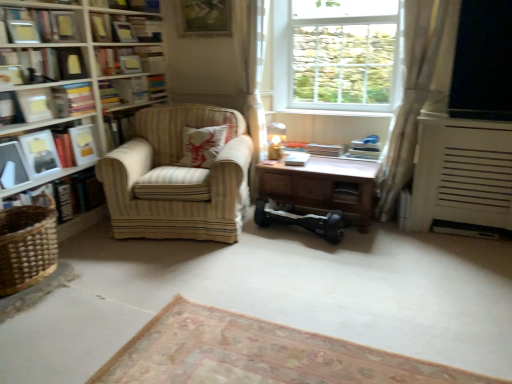
At what (x,y) coordinates should I click in order to perform the action: click on free space between striped fabric armchair at left and carpeted floor at lower center, arranged as the first plain when viewed from the back. Please return your answer as a coordinate pair (x, y). The width and height of the screenshot is (512, 384). Looking at the image, I should click on (236, 280).